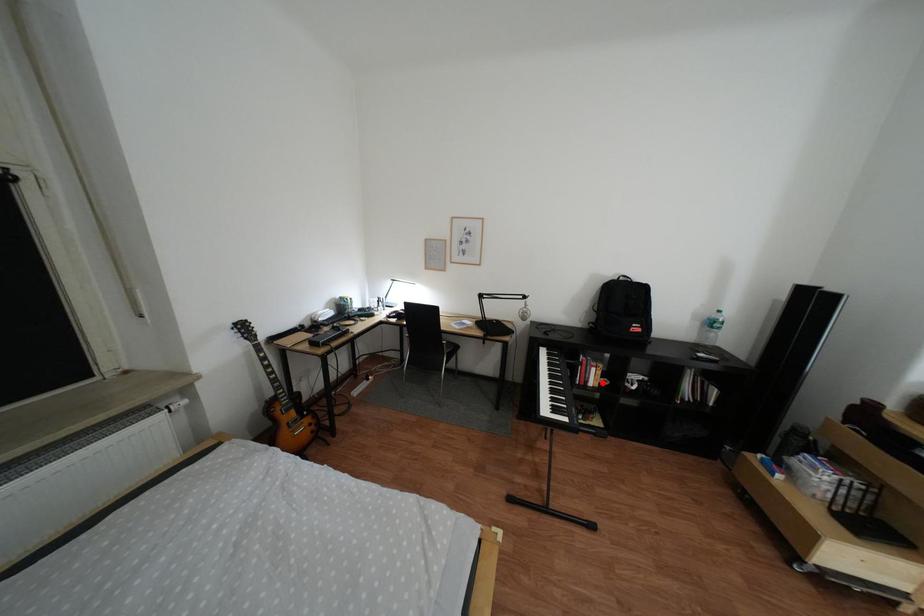
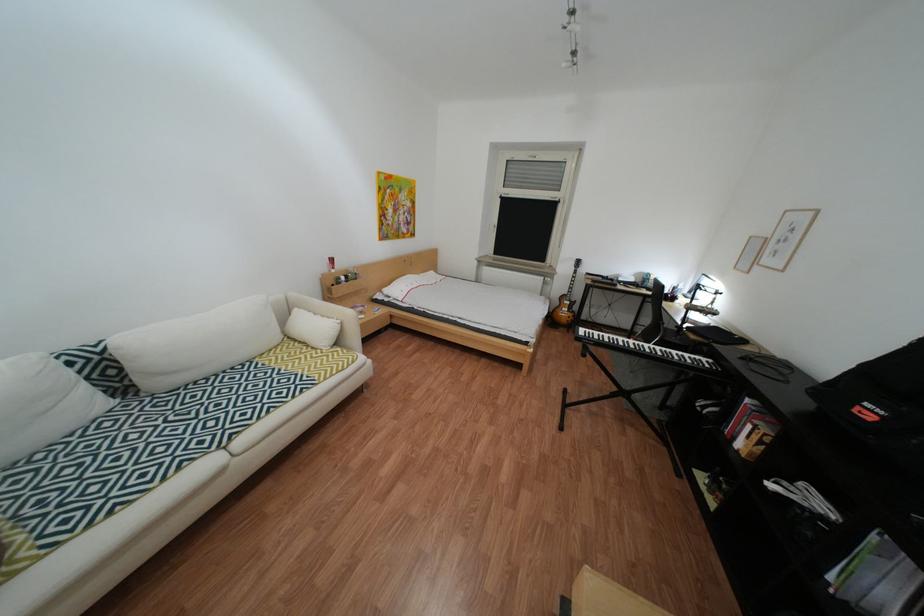
Find the pixel in the second image that matches the highlighted location in the first image.

(749, 439)